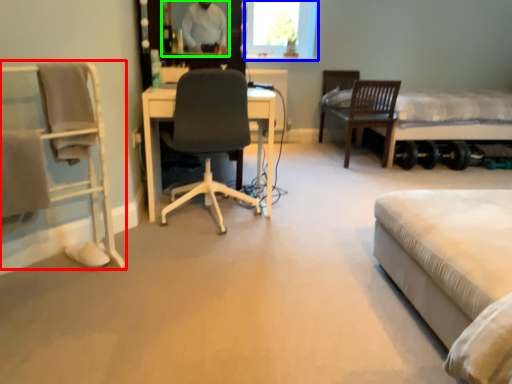
Question: Based on their relative distances, which object is farther from chair (highlighted by a red box)? Choose from window screen (highlighted by a blue box) and mirror (highlighted by a green box).

Choices:
 (A) window screen
 (B) mirror

Answer: (A)